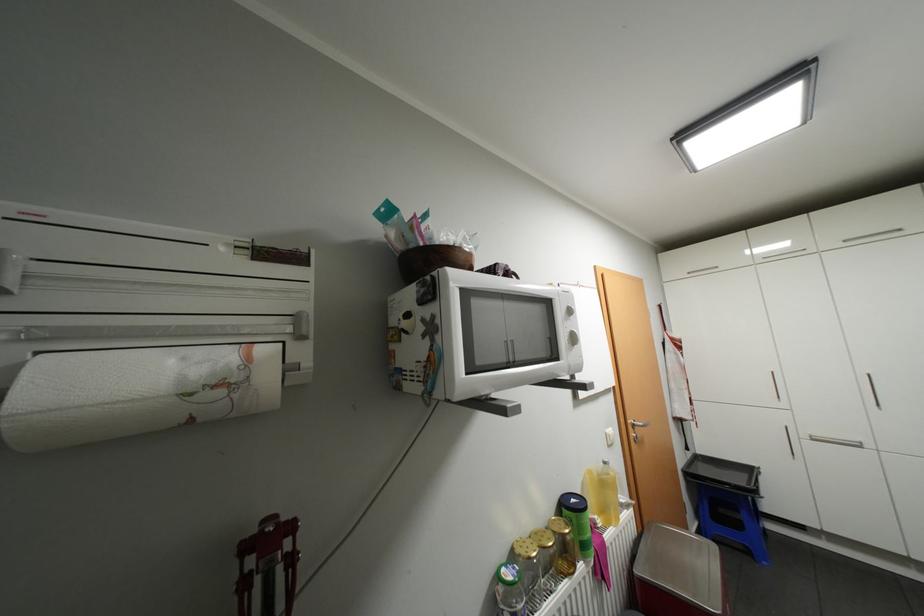
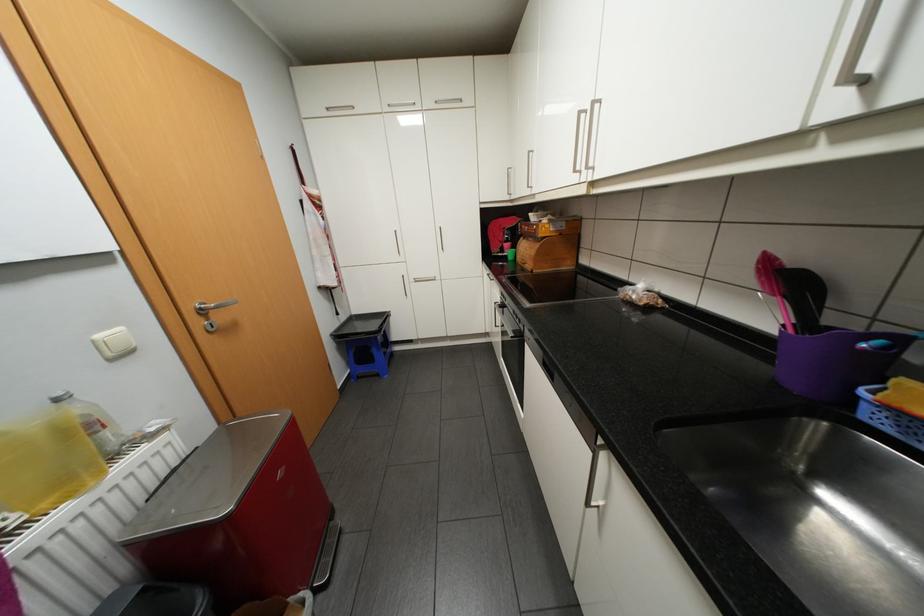
The point at (613, 462) is marked in the first image. Where is the corresponding point in the second image?

(65, 399)